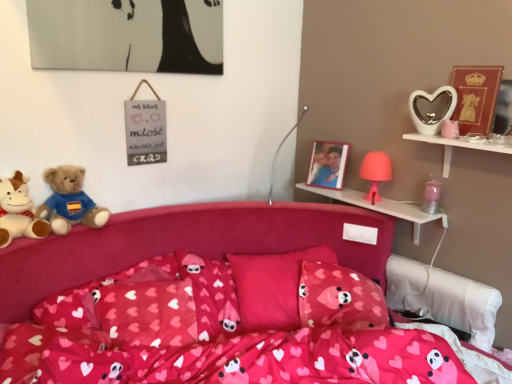
Question: Considering the positions of point (426, 135) and point (388, 160), is point (426, 135) closer or farther from the camera than point (388, 160)?

Choices:
 (A) farther
 (B) closer

Answer: (B)

Question: Which is correct: white glossy heart-shaped object at upper right, which ranks as the 2th shelf in back-to-front order, is inside matte pink lamp at upper right, which is counted as the second toy, starting from the bottom, or outside of it?

Choices:
 (A) outside
 (B) inside

Answer: (A)

Question: Which is nearer to the matte pink lamp at upper right, placed as the third toy when sorted from top to bottom?

Choices:
 (A) white glossy heart-shaped object at upper right, which ranks as the 2th shelf in back-to-front order
 (B) pink fabric bed at center
 (C) metallic silver jar at upper right, the 4th toy from the top
 (D) wooden photo frame at upper right, the 2th picture frame viewed from the right
 (E) soft plush teddy bear at left, the first teddy bear when ordered from left to right

Answer: (C)

Question: Which object is positioned farthest from the pink fabric pillow at center, the 1th pillow viewed from the left?

Choices:
 (A) pink fabric pillow at center, the 2th pillow from the left
 (B) white glossy heart-shaped object at upper right, the first toy when ordered from top to bottom
 (C) metallic silver jar at upper right, the 4th toy from the top
 (D) wooden photo frame at upper right, the first picture frame in the left-to-right sequence
 (E) pink plastic lamp at upper right, the first shelf from the back

Answer: (B)